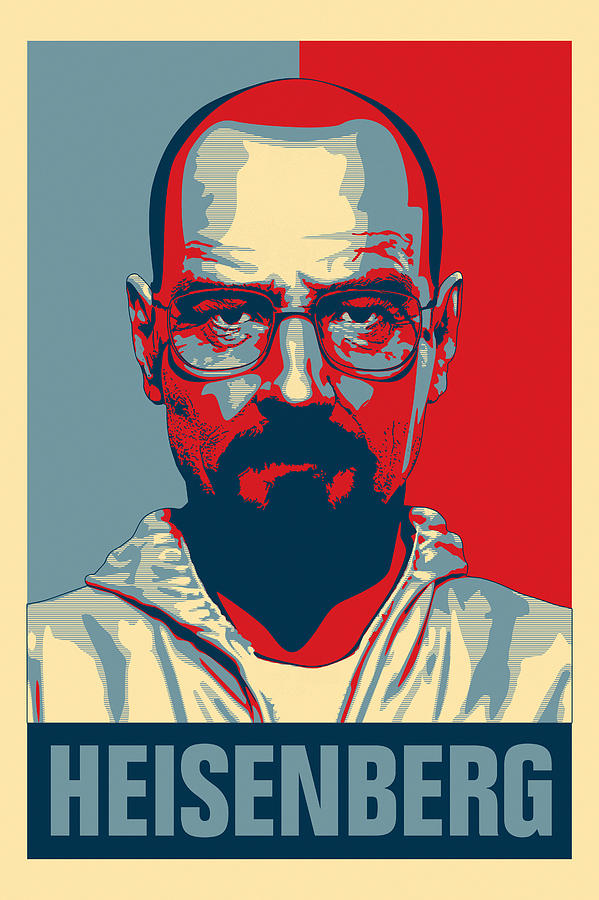
Where is `art work`? This screenshot has width=599, height=900. art work is located at coordinates (438, 649).